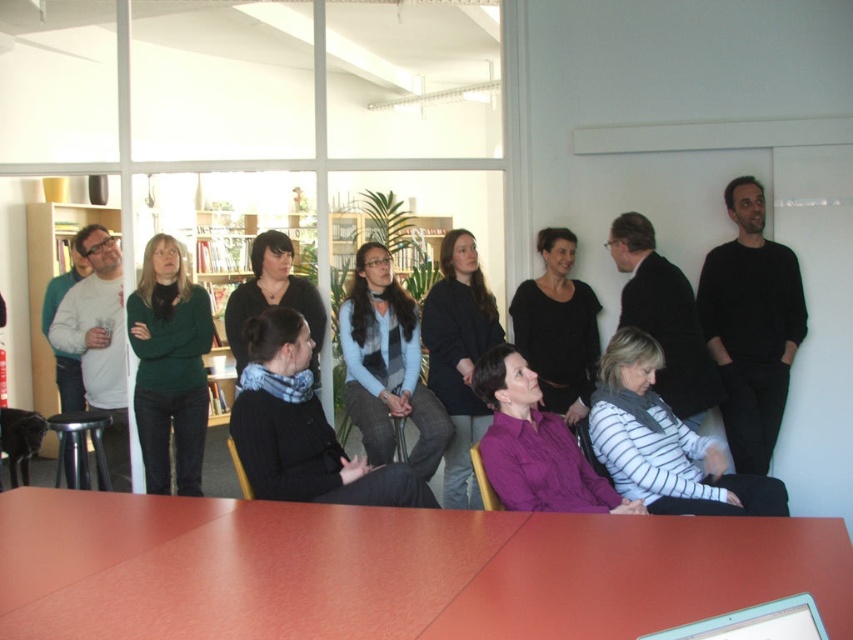
You are a photographer taking a group photo of the people at the meeting. You notice the light blue sweater at center and the black matte shirt at center. Which clothing item should you focus on first to ensure both are in frame?

The light blue sweater at center is taller than the black matte shirt at center, so you should focus on the light blue sweater at center first to ensure both are in frame.

You are attending a meeting in the office and notice two people wearing a light blue sweater at center and a black matte shirt at center. Which person is closer to you?

The light blue sweater at center is closer to you than the black matte shirt at center.